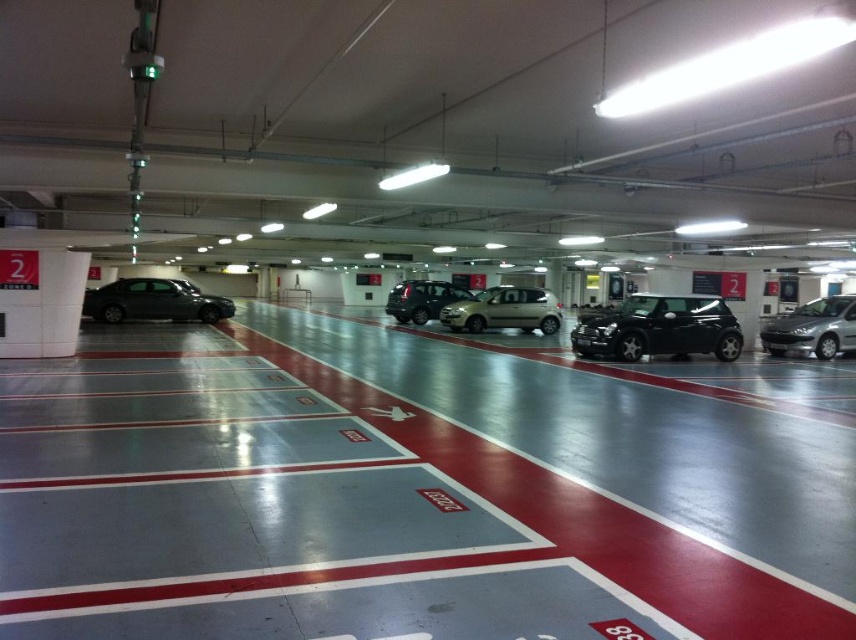
Question: Which point is farther to the camera?

Choices:
 (A) (484, 314)
 (B) (150, 301)
 (C) (395, 291)

Answer: (C)

Question: Is gray concrete floor at center wider than silver metallic hatchback at right?

Choices:
 (A) yes
 (B) no

Answer: (A)

Question: Considering the real-world distances, which object is closest to the shiny black sedan at left?

Choices:
 (A) silver metallic hatchback at right
 (B) glossy black car at center
 (C) satin black suv at center

Answer: (C)

Question: Is gray concrete floor at center to the left of glossy black car at center from the viewer's perspective?

Choices:
 (A) no
 (B) yes

Answer: (B)

Question: Which of the following is the farthest from the observer?

Choices:
 (A) (759, 330)
 (B) (687, 324)
 (C) (393, 417)

Answer: (A)

Question: Is glossy black car at center to the left of shiny black sedan at left from the viewer's perspective?

Choices:
 (A) no
 (B) yes

Answer: (A)